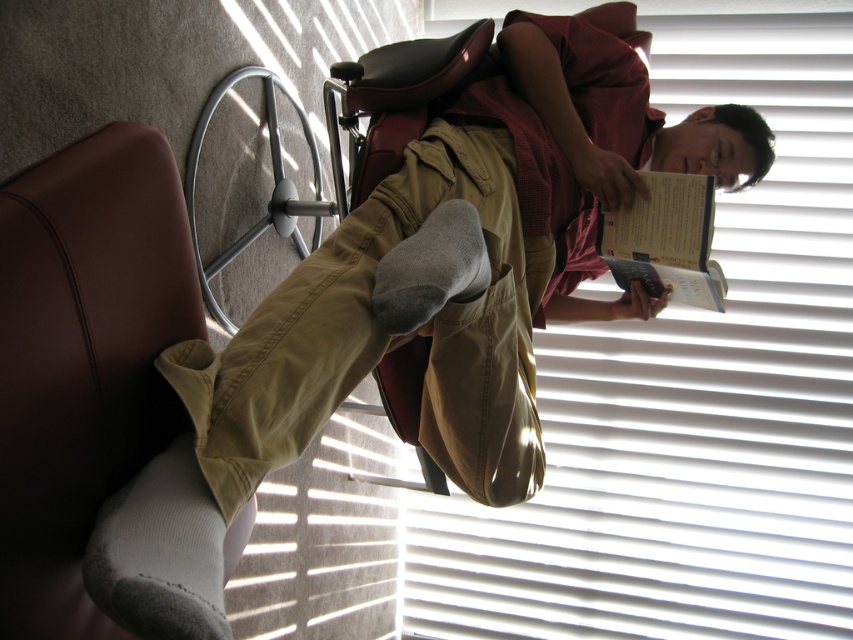
You are a delivery robot that needs to place a package between the hardcover book at right and the gray fleece sock at center. The package is 10 inches long. Can you fit it between them without moving either object?

The hardcover book at right is 21.46 inches away from the gray fleece sock at center, so yes, the package can fit between them as the distance is greater than the package length.

You are a tailor measuring items for a display. You have a khaki cotton pants at center and a hardcover book at right. Which item is taller?

The khaki cotton pants at center is taller than the hardcover book at right.

You are a tailor measuring clothing items in the image. You need to determine which item, the khaki cotton pants at center or the gray fleece sock at center, requires more fabric to make. Which one would you choose?

The khaki cotton pants at center is larger in size than the gray fleece sock at center, so it would require more fabric to make.